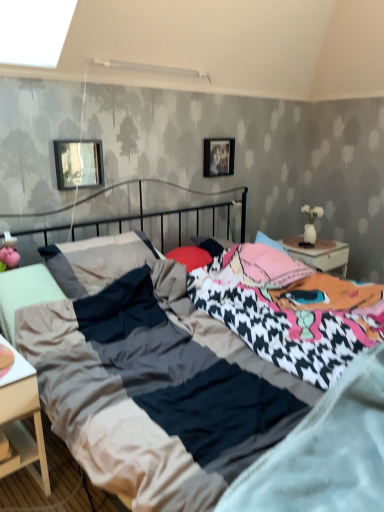
Measure the distance between metallic rectangular frame at upper left, positioned as the 2th picture frame in right-to-left order, and camera.

metallic rectangular frame at upper left, positioned as the 2th picture frame in right-to-left order, is 2.17 meters from camera.

The height and width of the screenshot is (512, 384). What do you see at coordinates (303, 283) in the screenshot? I see `textured cotton bed at center` at bounding box center [303, 283].

This screenshot has height=512, width=384. In order to click on metallic rectangular frame at upper left, which appears as the first picture frame when viewed from the front in this screenshot , I will do `click(78, 163)`.

Which is more to the right, metallic silver picture frame at upper center, which is the second picture frame from front to back, or metallic rectangular frame at upper left, which appears as the 1th picture frame when viewed from the left?

Positioned to the right is metallic silver picture frame at upper center, which is the second picture frame from front to back.

From a real-world perspective, is metallic silver picture frame at upper center, the 2th picture frame from the left, positioned under metallic rectangular frame at upper left, positioned as the 2th picture frame in right-to-left order, based on gravity?

Actually, metallic silver picture frame at upper center, the 2th picture frame from the left, is physically above metallic rectangular frame at upper left, positioned as the 2th picture frame in right-to-left order, in the real world.

How many degrees apart are the facing directions of metallic silver picture frame at upper center, marked as the 1th picture frame in a back-to-front arrangement, and metallic rectangular frame at upper left, which appears as the first picture frame when viewed from the front?

0.958 degrees separate the facing orientations of metallic silver picture frame at upper center, marked as the 1th picture frame in a back-to-front arrangement, and metallic rectangular frame at upper left, which appears as the first picture frame when viewed from the front.

Considering the positions of points (230, 163) and (70, 170), is point (230, 163) farther from camera compared to point (70, 170)?

That is True.

Does textured cotton bed at center turn towards white matte nightstand at lower left?

No, textured cotton bed at center is not turned towards white matte nightstand at lower left.

Considering their positions, is textured cotton bed at center located in front of or behind white matte nightstand at lower left?

Clearly, textured cotton bed at center is in front of white matte nightstand at lower left.

Looking at this image, between textured cotton bed at center and white matte nightstand at lower left, which one has larger size?

textured cotton bed at center.

How different are the orientations of textured cotton bed at center and white matte nightstand at lower left in degrees?

The facing directions of textured cotton bed at center and white matte nightstand at lower left are 0.602 degrees apart.

Is metallic rectangular frame at upper left, which appears as the first picture frame when viewed from the front, positioned far away from soft cotton mattress at center?

Indeed, metallic rectangular frame at upper left, which appears as the first picture frame when viewed from the front, is not near soft cotton mattress at center.

Looking at this image, is metallic rectangular frame at upper left, positioned as the 2th picture frame in right-to-left order, smaller than soft cotton mattress at center?

Yes.

From the image's perspective, which object appears higher, metallic rectangular frame at upper left, which appears as the first picture frame when viewed from the front, or soft cotton mattress at center?

metallic rectangular frame at upper left, which appears as the first picture frame when viewed from the front.

From their relative heights in the image, would you say white matte nightstand at lower left is taller or shorter than metallic silver picture frame at upper center, which appears as the first picture frame when viewed from the right?

In the image, white matte nightstand at lower left appears to be taller than metallic silver picture frame at upper center, which appears as the first picture frame when viewed from the right.

Is white matte nightstand at lower left closer to the viewer compared to metallic silver picture frame at upper center, marked as the 1th picture frame in a back-to-front arrangement?

Yes, the depth of white matte nightstand at lower left is less than that of metallic silver picture frame at upper center, marked as the 1th picture frame in a back-to-front arrangement.

Does point (24, 378) come in front of point (220, 167)?

Yes, it is in front of point (220, 167).

Which of these two, textured cotton bed at center or soft cotton mattress at center, is wider?

textured cotton bed at center is wider.

Is point (192, 207) positioned in front of point (347, 425)?

No, (192, 207) is further to viewer.

Which object is closer to the camera, textured cotton bed at center or soft cotton mattress at center?

textured cotton bed at center is closer to the camera.

Which of these two, textured cotton bed at center or soft cotton mattress at center, stands shorter?

With less height is soft cotton mattress at center.

Based on the photo, between white matte nightstand at lower left and soft cotton mattress at center, which one has larger size?

soft cotton mattress at center.

Is white matte nightstand at lower left spatially inside soft cotton mattress at center, or outside of it?

white matte nightstand at lower left exists outside the volume of soft cotton mattress at center.

Who is shorter, white matte nightstand at lower left or soft cotton mattress at center?

With less height is soft cotton mattress at center.

From the image's perspective, which is below, white matte nightstand at lower left or soft cotton mattress at center?

white matte nightstand at lower left is shown below in the image.

How many degrees apart are the facing directions of textured cotton bed at center and metallic silver picture frame at upper center, the 2th picture frame from the left?

The angle between the facing direction of textured cotton bed at center and the facing direction of metallic silver picture frame at upper center, the 2th picture frame from the left, is 0.305 degrees.

In the scene shown: Between textured cotton bed at center and metallic silver picture frame at upper center, which is the second picture frame from front to back, which one is positioned behind?

metallic silver picture frame at upper center, which is the second picture frame from front to back, is more distant.

Looking at this image, which point is more forward, (253,252) or (223,149)?

The point (253,252) is closer.

Is textured cotton bed at center at the left side of metallic silver picture frame at upper center, which appears as the first picture frame when viewed from the right?

In fact, textured cotton bed at center is to the right of metallic silver picture frame at upper center, which appears as the first picture frame when viewed from the right.

Where is `picture frame behind the metallic rectangular frame at upper left, which appears as the 1th picture frame when viewed from the left`? The image size is (384, 512). picture frame behind the metallic rectangular frame at upper left, which appears as the 1th picture frame when viewed from the left is located at coordinates click(x=219, y=157).

Identify the location of bed to the right of white matte nightstand at lower left. (303, 283).

Consider the image. When comparing their distances from metallic silver picture frame at upper center, the 2th picture frame from the left, does white matte nightstand at lower left or metallic rectangular frame at upper left, which ranks as the second picture frame in back-to-front order, seem further?

white matte nightstand at lower left is further to metallic silver picture frame at upper center, the 2th picture frame from the left.

Looking at the image, which one is located closer to metallic rectangular frame at upper left, which appears as the first picture frame when viewed from the front, metallic silver picture frame at upper center, marked as the 1th picture frame in a back-to-front arrangement, or white matte nightstand at lower left?

metallic silver picture frame at upper center, marked as the 1th picture frame in a back-to-front arrangement, is positioned closer to the anchor metallic rectangular frame at upper left, which appears as the first picture frame when viewed from the front.

From the picture: From the image, which object appears to be nearer to metallic rectangular frame at upper left, which appears as the 1th picture frame when viewed from the left, textured cotton bed at center or metallic silver picture frame at upper center, marked as the 1th picture frame in a back-to-front arrangement?

textured cotton bed at center lies closer to metallic rectangular frame at upper left, which appears as the 1th picture frame when viewed from the left, than the other object.

When comparing their distances from metallic rectangular frame at upper left, which ranks as the second picture frame in back-to-front order, does metallic silver picture frame at upper center, the 2th picture frame from the left, or textured cotton bed at center seem closer?

textured cotton bed at center is positioned closer to the anchor metallic rectangular frame at upper left, which ranks as the second picture frame in back-to-front order.

Estimate the real-world distances between objects in this image. Which object is further from white matte nightstand at lower left, metallic rectangular frame at upper left, which ranks as the second picture frame in back-to-front order, or metallic silver picture frame at upper center, the 2th picture frame from the left?

Based on the image, metallic silver picture frame at upper center, the 2th picture frame from the left, appears to be further to white matte nightstand at lower left.

Which object lies further to the anchor point soft cotton mattress at center, white matte nightstand at lower left or metallic rectangular frame at upper left, which ranks as the second picture frame in back-to-front order?

metallic rectangular frame at upper left, which ranks as the second picture frame in back-to-front order, is positioned further to the anchor soft cotton mattress at center.

Considering their positions, is soft cotton mattress at center positioned further to metallic silver picture frame at upper center, which appears as the first picture frame when viewed from the right, than metallic rectangular frame at upper left, which appears as the first picture frame when viewed from the front?

soft cotton mattress at center is further to metallic silver picture frame at upper center, which appears as the first picture frame when viewed from the right.

When comparing their distances from soft cotton mattress at center, does metallic silver picture frame at upper center, the 2th picture frame from the left, or white matte nightstand at lower left seem closer?

white matte nightstand at lower left is positioned closer to the anchor soft cotton mattress at center.

Identify the location of nightstand between textured cotton bed at center and metallic rectangular frame at upper left, which ranks as the second picture frame in back-to-front order, along the z-axis. click(x=21, y=418).

Locate an element on the screen. Image resolution: width=384 pixels, height=512 pixels. picture frame between textured cotton bed at center and metallic silver picture frame at upper center, marked as the 1th picture frame in a back-to-front arrangement, along the z-axis is located at coordinates (78, 163).

Identify the location of picture frame between soft cotton mattress at center and metallic silver picture frame at upper center, marked as the 1th picture frame in a back-to-front arrangement, in the front-back direction. (78, 163).

The width and height of the screenshot is (384, 512). I want to click on nightstand between soft cotton mattress at center and metallic rectangular frame at upper left, which ranks as the second picture frame in back-to-front order, along the z-axis, so click(x=21, y=418).